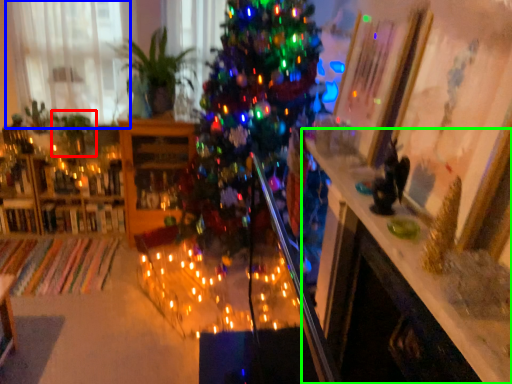
Question: Which object is positioned closest to plant (highlighted by a red box)? Select from window (highlighted by a blue box) and table (highlighted by a green box).

Choices:
 (A) window
 (B) table

Answer: (A)